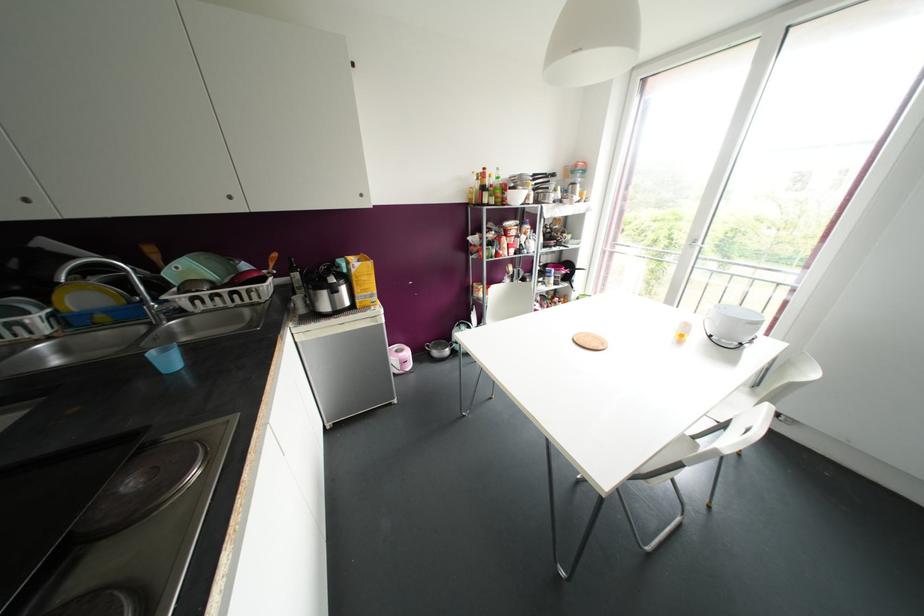
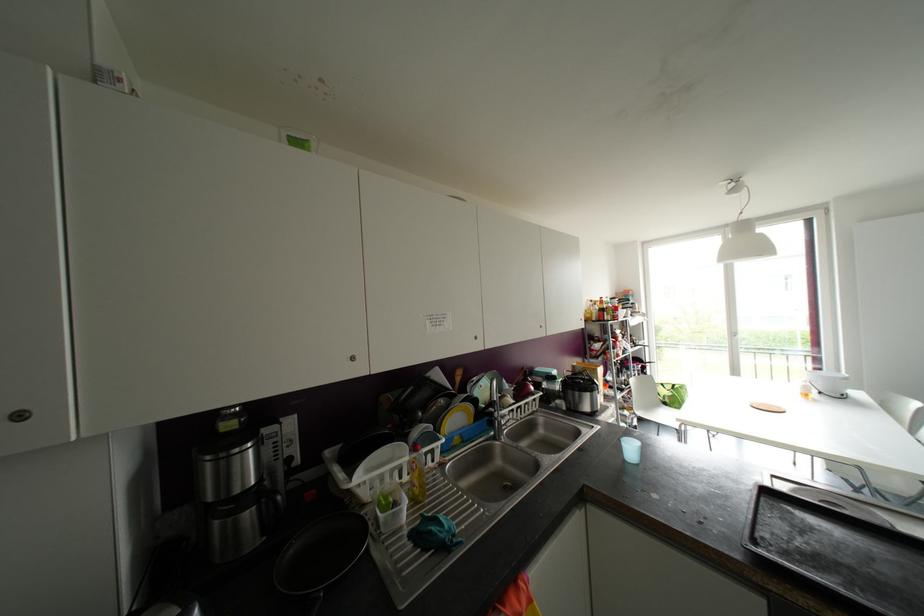
Question: What movement of the cameraman would produce the second image?

Choices:
 (A) Left
 (B) Right
 (C) Forward
 (D) Backward

Answer: (A)